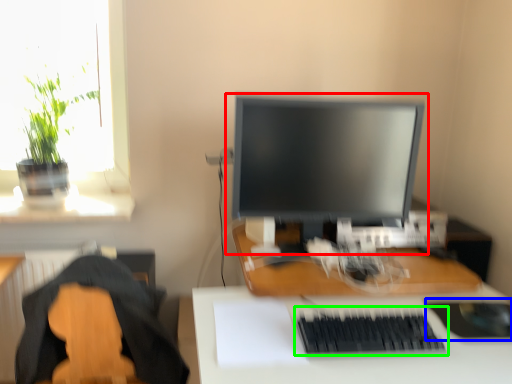
Question: Estimate the real-world distances between objects in this image. Which object is closer to computer monitor (highlighted by a red box), mousepad (highlighted by a blue box) or computer keyboard (highlighted by a green box)?

Choices:
 (A) mousepad
 (B) computer keyboard

Answer: (B)